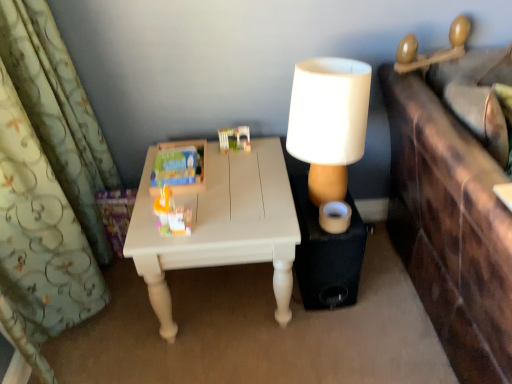
Question: From a real-world perspective, is white painted wood table at center positioned over white matte lampshade at upper right based on gravity?

Choices:
 (A) yes
 (B) no

Answer: (B)

Question: Is white painted wood table at center at the left side of white matte lampshade at upper right?

Choices:
 (A) yes
 (B) no

Answer: (A)

Question: Does white painted wood table at center have a larger size compared to white matte lampshade at upper right?

Choices:
 (A) no
 (B) yes

Answer: (B)

Question: From the image's perspective, is white painted wood table at center beneath white matte lampshade at upper right?

Choices:
 (A) no
 (B) yes

Answer: (B)

Question: Is white painted wood table at center outside of white matte lampshade at upper right?

Choices:
 (A) yes
 (B) no

Answer: (A)

Question: Is white painted wood table at center facing away from white matte lampshade at upper right?

Choices:
 (A) yes
 (B) no

Answer: (B)

Question: Does plastic building blocks at center, which is counted as the 3th toy, starting from the left, have a larger size compared to translucent plastic toy at center, which appears as the 2th toy when viewed from the left?

Choices:
 (A) no
 (B) yes

Answer: (A)

Question: From the image's perspective, is plastic building blocks at center, which is counted as the 3th toy, starting from the left, on translucent plastic toy at center, which appears as the 2th toy when viewed from the left?

Choices:
 (A) no
 (B) yes

Answer: (B)

Question: Is plastic building blocks at center, which is counted as the 3th toy, starting from the left, oriented away from translucent plastic toy at center, which is the 2th toy in right-to-left order?

Choices:
 (A) no
 (B) yes

Answer: (A)

Question: Can you confirm if plastic building blocks at center, which ranks as the first toy in right-to-left order, is smaller than translucent plastic toy at center, which appears as the 2th toy when viewed from the left?

Choices:
 (A) no
 (B) yes

Answer: (B)

Question: Is plastic building blocks at center, which is counted as the 3th toy, starting from the left, thinner than translucent plastic toy at center, which is the 2th toy in right-to-left order?

Choices:
 (A) yes
 (B) no

Answer: (B)

Question: Considering the relative sizes of plastic building blocks at center, which ranks as the first toy in right-to-left order, and translucent plastic toy at center, which is the 2th toy in right-to-left order, in the image provided, is plastic building blocks at center, which ranks as the first toy in right-to-left order, taller than translucent plastic toy at center, which is the 2th toy in right-to-left order,?

Choices:
 (A) yes
 (B) no

Answer: (B)

Question: Does plastic building blocks at center, which is counted as the 3th toy, starting from the left, have a greater width compared to matte plastic toy at center, positioned as the 1th toy in left-to-right order?

Choices:
 (A) yes
 (B) no

Answer: (B)